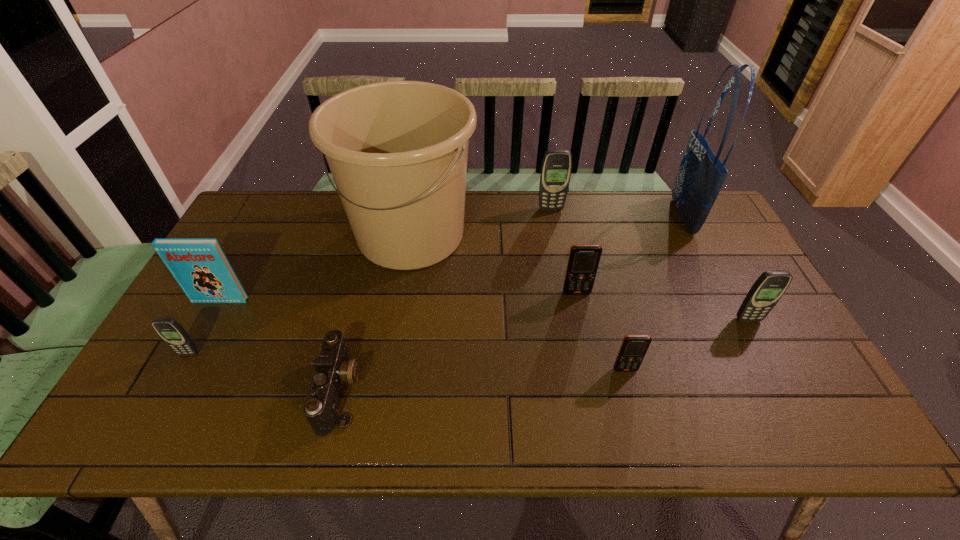
The width and height of the screenshot is (960, 540). I want to click on the tallest object, so click(701, 175).

Find the location of a particular element. beige bucket is located at coordinates (397, 150).

Locate an element on the screen. The image size is (960, 540). the eighth shortest object is located at coordinates (397, 150).

Find the location of a particular element. The image size is (960, 540). the farthest cellular telephone is located at coordinates (556, 168).

Image resolution: width=960 pixels, height=540 pixels. In order to click on the farthest gray cellular telephone in this screenshot , I will do `click(556, 168)`.

Locate an element on the screen. the fifth nearest object is located at coordinates (201, 268).

Where is `book`? This screenshot has height=540, width=960. book is located at coordinates (201, 268).

Identify the location of the second smallest gray cellular telephone. The width and height of the screenshot is (960, 540). (767, 290).

Locate an element on the screen. the rightmost gray cellular telephone is located at coordinates (767, 290).

Find the location of a particular element. Image resolution: width=960 pixels, height=540 pixels. the farther orange cellular telephone is located at coordinates (583, 262).